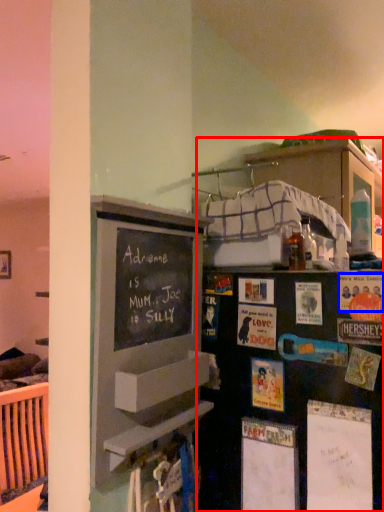
Question: Which object appears closest to the camera in this image, bookshelf (highlighted by a red box) or postcard (highlighted by a blue box)?

Choices:
 (A) bookshelf
 (B) postcard

Answer: (A)